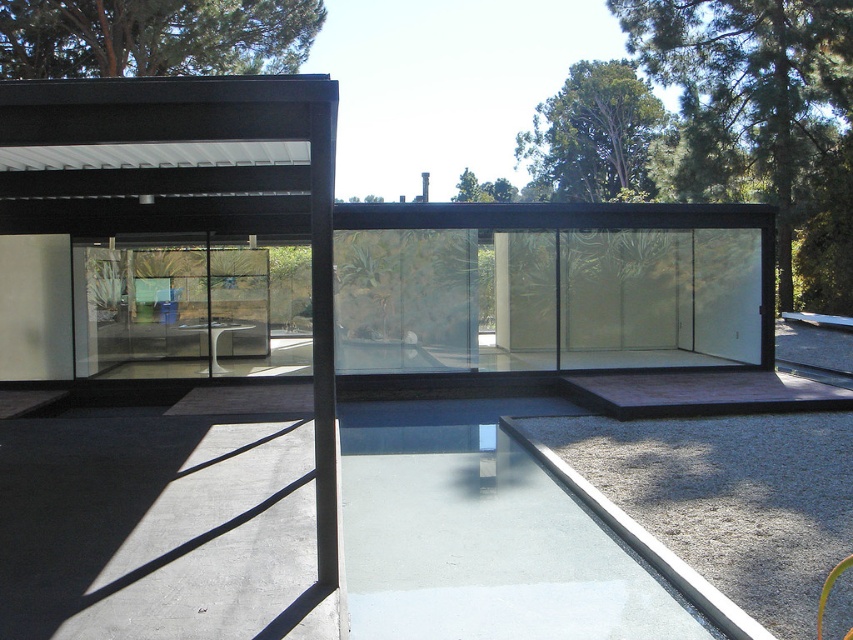
Question: Based on their relative distances, which object is nearer to the frosted glass wall at center?

Choices:
 (A) transparent glass pool at center
 (B) transparent glass door at center

Answer: (B)

Question: Can you confirm if frosted glass wall at center is positioned above transparent glass door at center?

Choices:
 (A) yes
 (B) no

Answer: (B)

Question: Which object is positioned closest to the transparent glass pool at center?

Choices:
 (A) transparent glass door at center
 (B) frosted glass wall at center

Answer: (B)

Question: Does frosted glass wall at center have a larger size compared to transparent glass door at center?

Choices:
 (A) yes
 (B) no

Answer: (A)

Question: Among these objects, which one is farthest from the camera?

Choices:
 (A) transparent glass door at center
 (B) transparent glass pool at center

Answer: (A)

Question: Is transparent glass pool at center wider than transparent glass door at center?

Choices:
 (A) no
 (B) yes

Answer: (A)